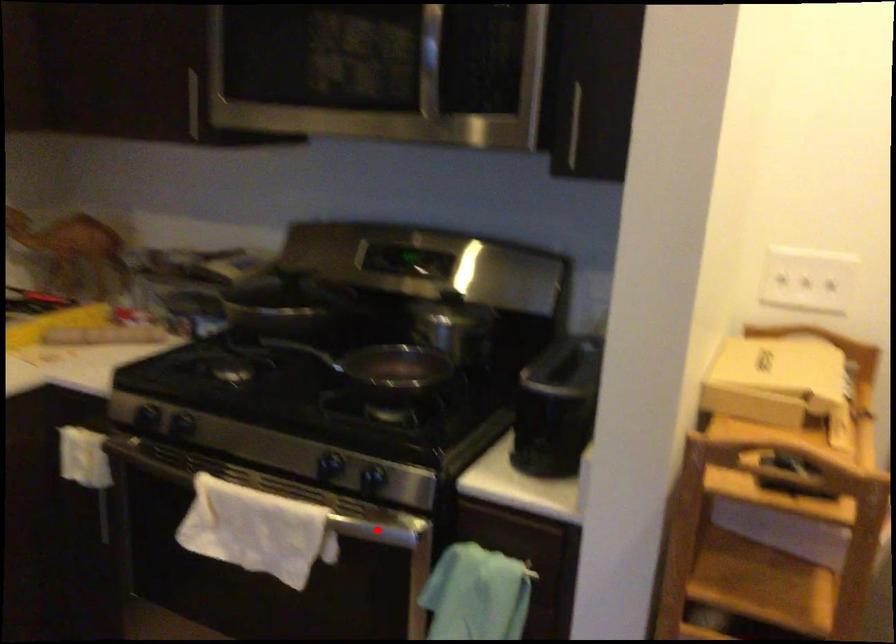
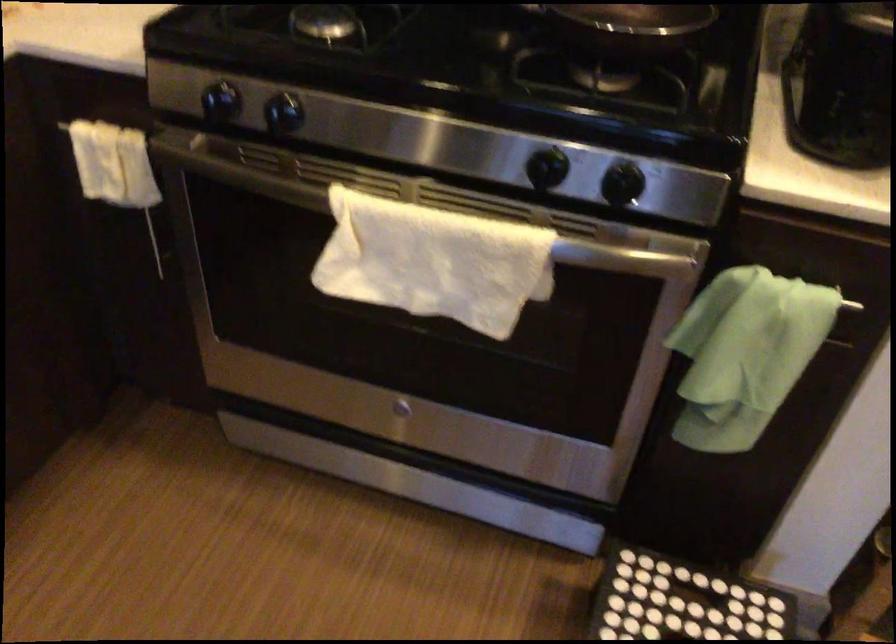
Locate, in the second image, the point that corresponds to the highlighted location in the first image.

(618, 257)